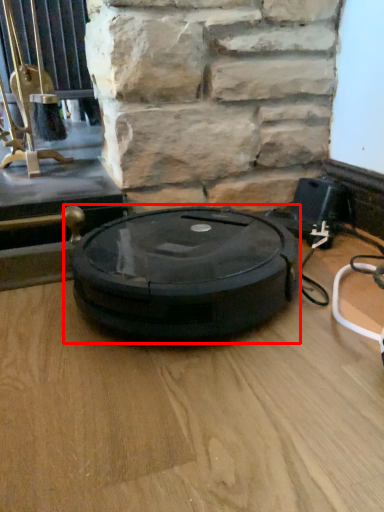
Question: Where is weight scale (annotated by the red box) located in relation to window in the image?

Choices:
 (A) left
 (B) right

Answer: (B)